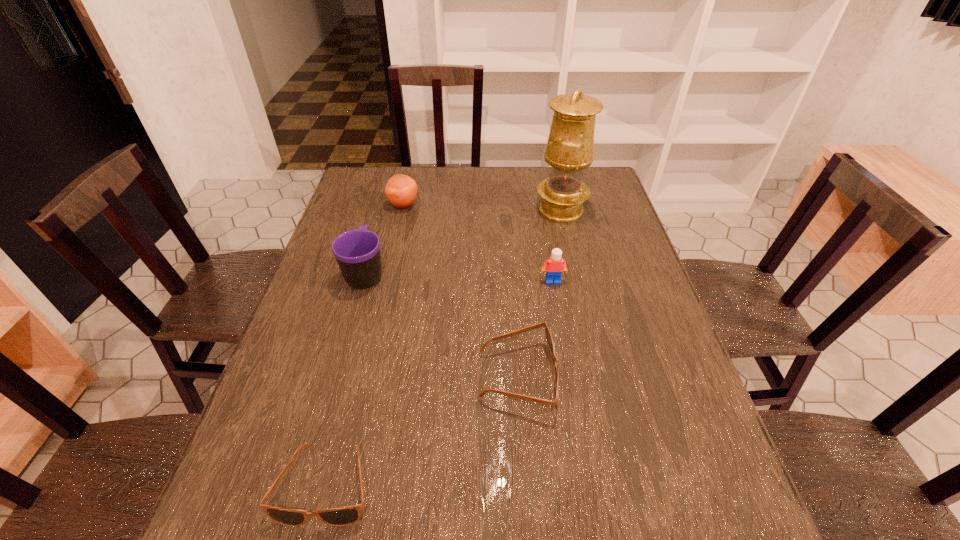
Locate an element on the screen. the nearer sunglasses is located at coordinates (343, 516).

Where is `the shorter sunglasses`? This screenshot has height=540, width=960. the shorter sunglasses is located at coordinates (343, 516).

I want to click on the right sunglasses, so click(x=549, y=338).

Where is `the taller sunglasses`? Image resolution: width=960 pixels, height=540 pixels. the taller sunglasses is located at coordinates (549, 338).

You are a GUI agent. You are given a task and a screenshot of the screen. Output one action in this format:
    pyautogui.click(x=<x>, y=<y>)
    Task: Click on the orange
    Image resolution: width=960 pixels, height=540 pixels.
    Given the screenshot: What is the action you would take?
    pyautogui.click(x=401, y=190)

At what (x,y) coordinates should I click in order to perform the action: click on mug. Please return your answer as a coordinate pair (x, y). Looking at the image, I should click on (357, 252).

The image size is (960, 540). Identify the location of the tallest object. (569, 151).

Where is `Lego`? This screenshot has width=960, height=540. Lego is located at coordinates (555, 265).

The width and height of the screenshot is (960, 540). In order to click on free space located 0.110m on the frames of the second nearest object in this screenshot , I will do `click(605, 376)`.

Where is `free location located on the front of the orange`? free location located on the front of the orange is located at coordinates (387, 276).